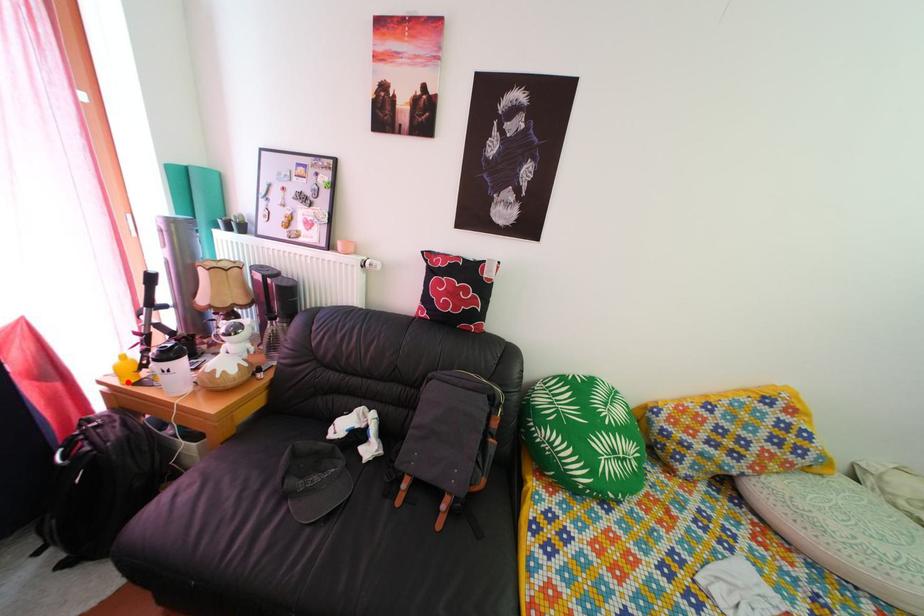
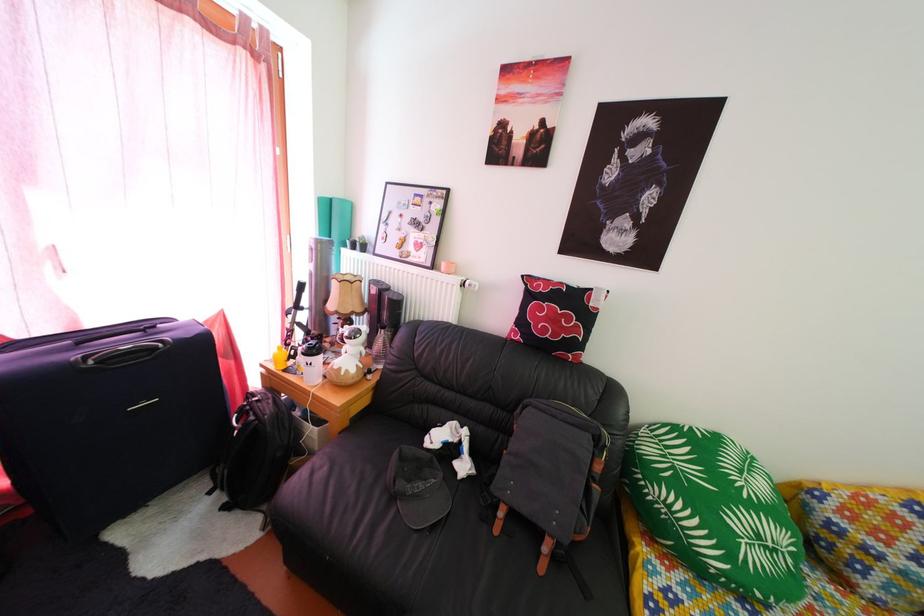
Locate, in the second image, the point that corresponds to the highlighted location in the first image.

(283, 369)